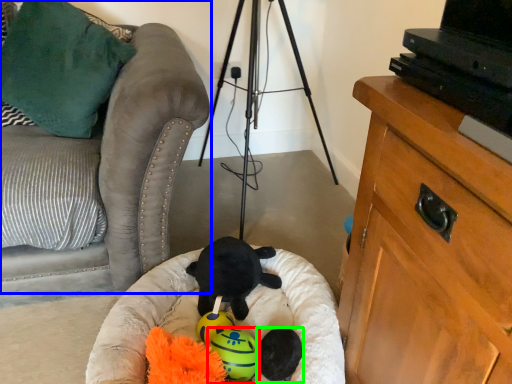
Question: Which object is positioned farthest from toy (highlighted by a red box)? Select from furniture (highlighted by a blue box) and toy (highlighted by a green box).

Choices:
 (A) furniture
 (B) toy

Answer: (A)